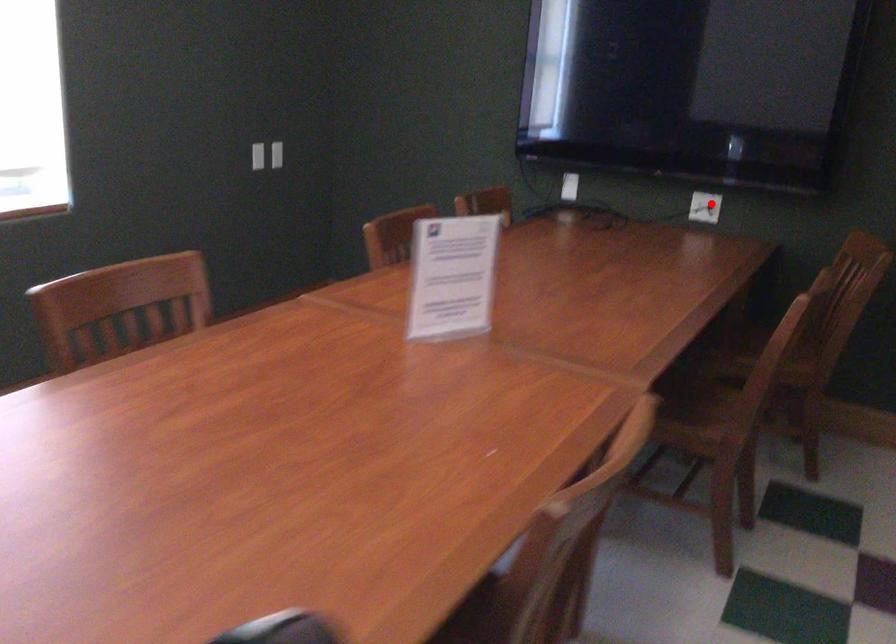
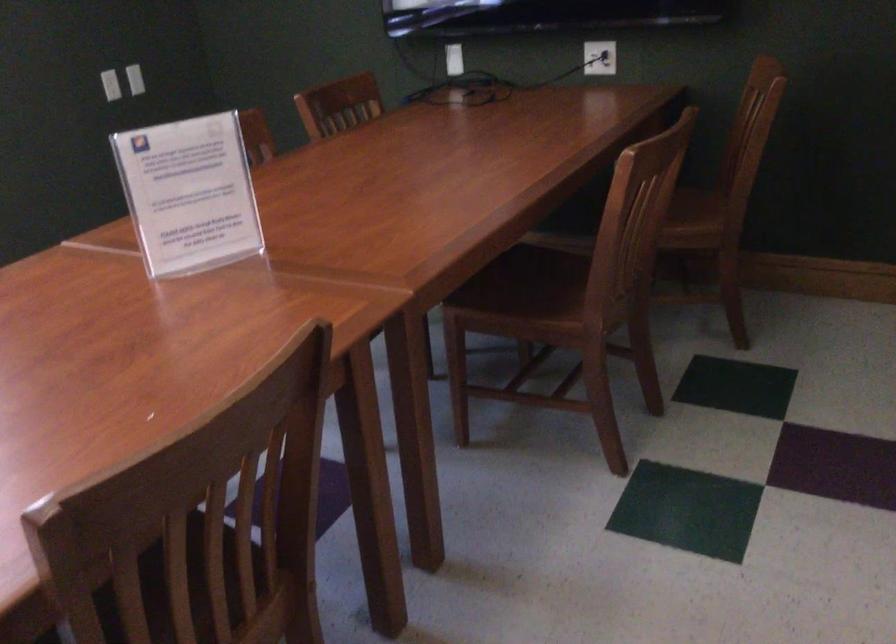
The point at the highlighted location is marked in the first image. Where is the corresponding point in the second image?

(599, 58)